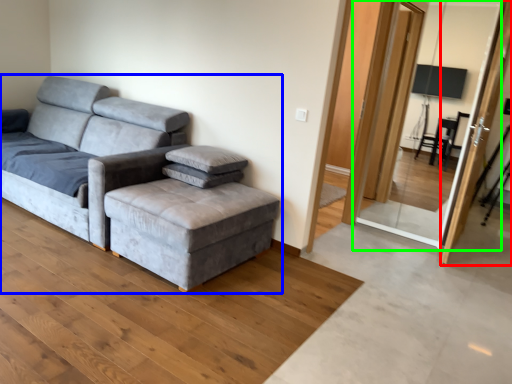
Question: Estimate the real-world distances between objects in this image. Which object is closer to screen door (highlighted by a red box), studio couch (highlighted by a blue box) or screen door (highlighted by a green box)?

Choices:
 (A) studio couch
 (B) screen door

Answer: (A)